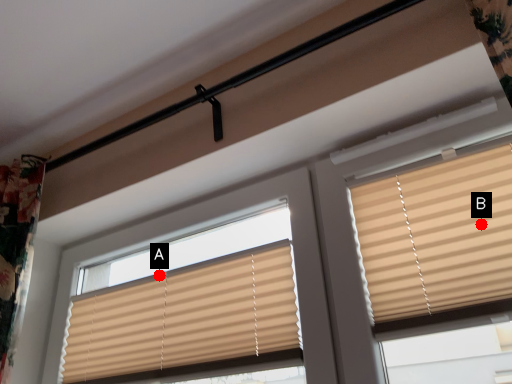
Question: Two points are circled on the image, labeled by A and B beside each circle. Which point appears closest to the camera in this image?

Choices:
 (A) A is closer
 (B) B is closer

Answer: (B)